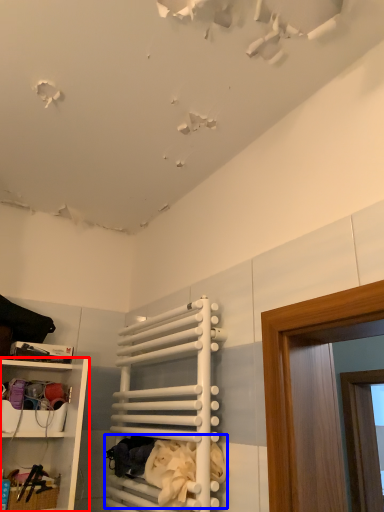
Question: Among these objects, which one is farthest to the camera, shelf (highlighted by a red box) or laundry (highlighted by a blue box)?

Choices:
 (A) shelf
 (B) laundry

Answer: (A)